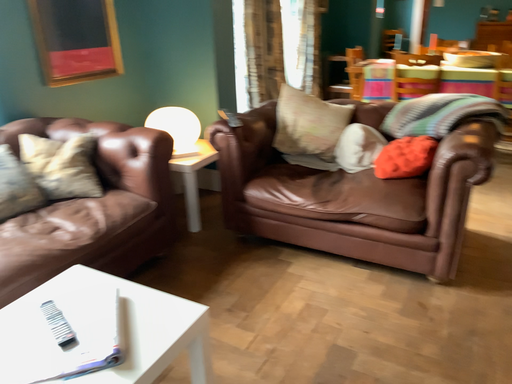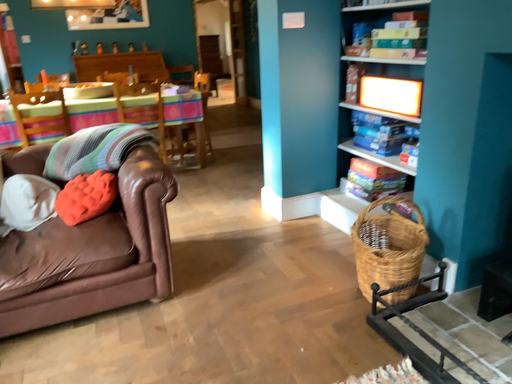
Question: How did the camera likely rotate when shooting the video?

Choices:
 (A) rotated upward
 (B) rotated downward

Answer: (A)